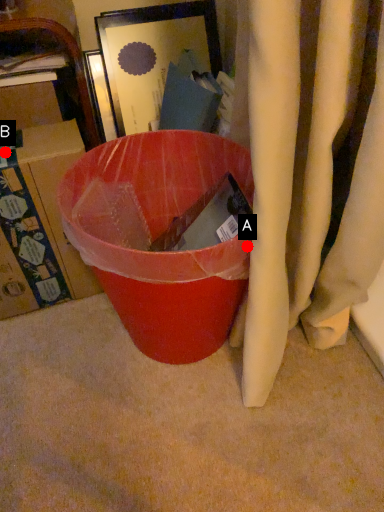
Question: Two points are circled on the image, labeled by A and B beside each circle. Which of the following is the closest to the observer?

Choices:
 (A) A is closer
 (B) B is closer

Answer: (A)